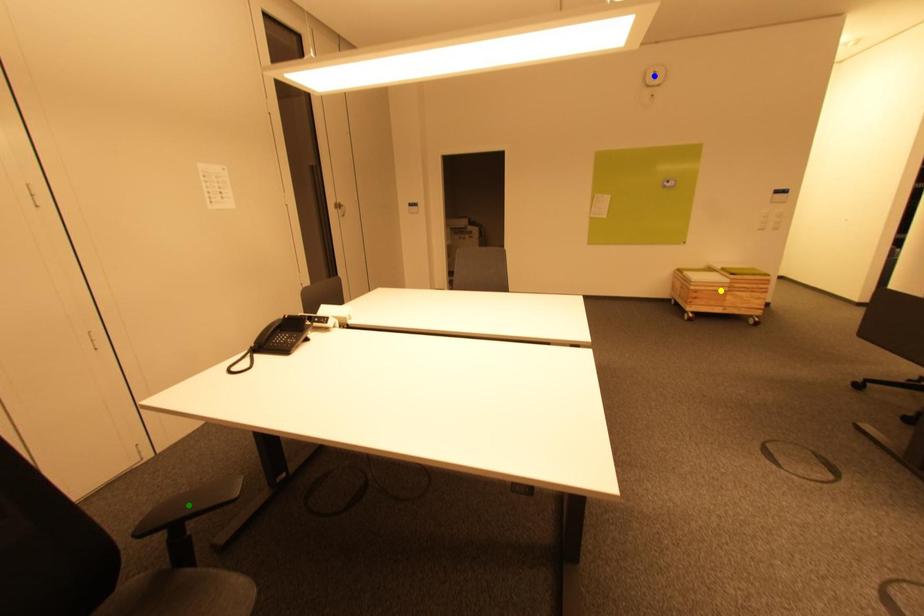
Consider the image. Order these from farthest to nearest:
blue point | green point | yellow point

1. blue point
2. yellow point
3. green point